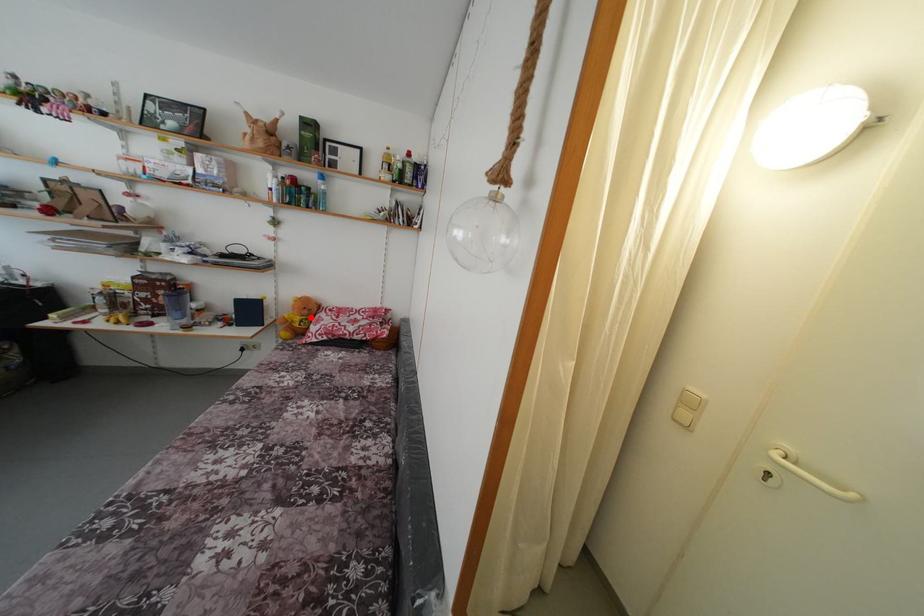
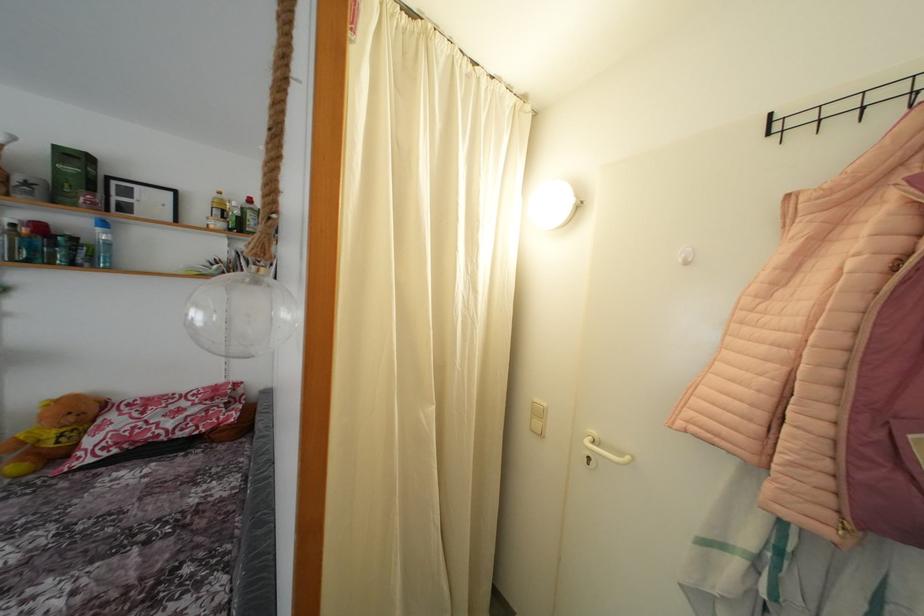
In the second image, find the point that corresponds to the highlighted location in the first image.

(77, 424)